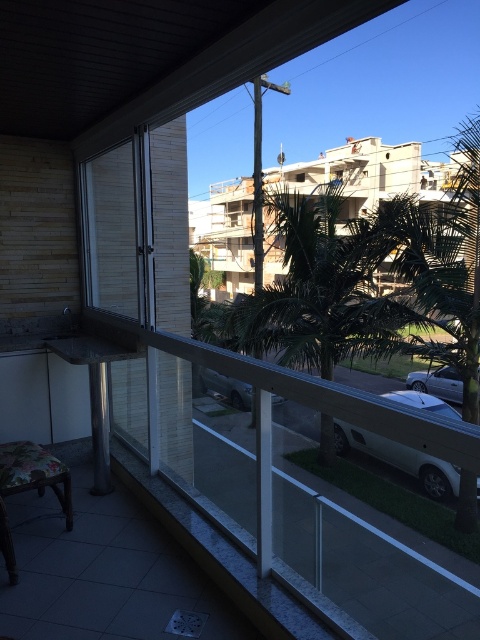
Question: Estimate the real-world distances between objects in this image. Which object is farther from the silver metallic car at lower right?

Choices:
 (A) silver metallic car at center
 (B) white matte car at lower right

Answer: (A)

Question: Is floral fabric cushion at lower left behind silver metallic car at lower right?

Choices:
 (A) no
 (B) yes

Answer: (A)

Question: Which object appears closest to the camera in this image?

Choices:
 (A) silver metallic car at center
 (B) floral fabric cushion at lower left
 (C) white matte car at lower right
 (D) silver metallic car at lower right

Answer: (C)

Question: Does white matte car at lower right appear over floral fabric cushion at lower left?

Choices:
 (A) yes
 (B) no

Answer: (B)

Question: In this image, where is silver metallic car at lower right located relative to silver metallic car at center?

Choices:
 (A) right
 (B) left

Answer: (A)

Question: Among these points, which one is farthest from the camera?

Choices:
 (A) (452, 481)
 (B) (252, 392)

Answer: (B)